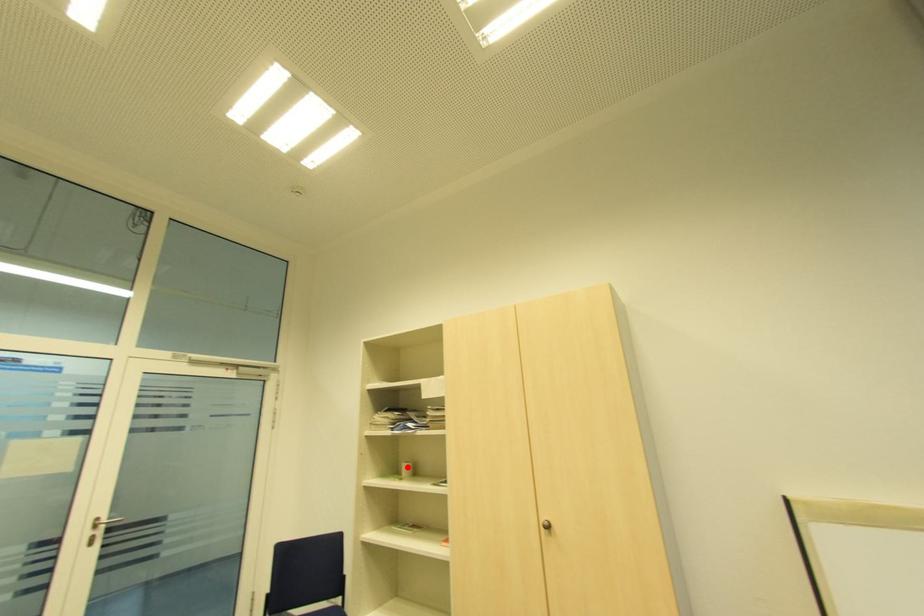
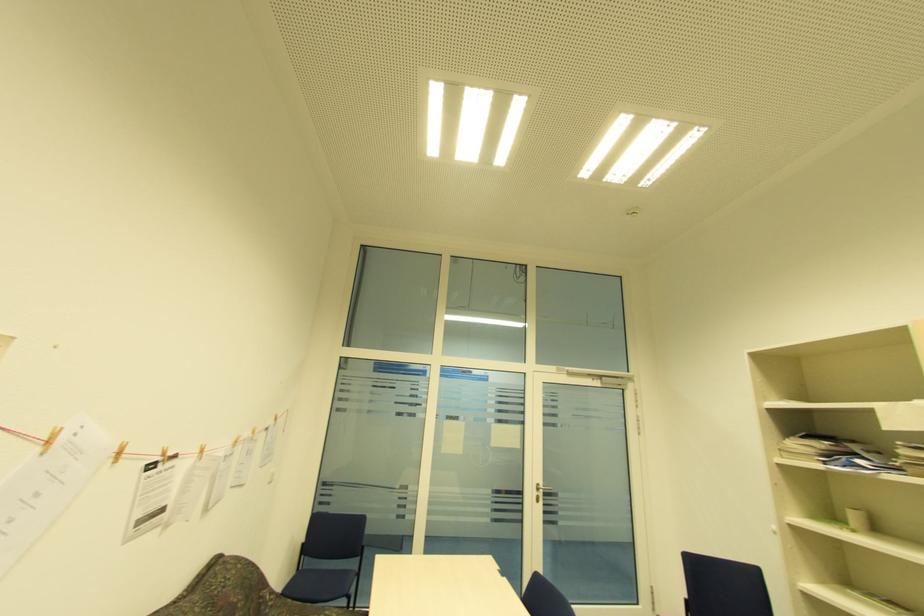
Locate, in the second image, the point that corresponds to the highlighted location in the first image.

(857, 517)